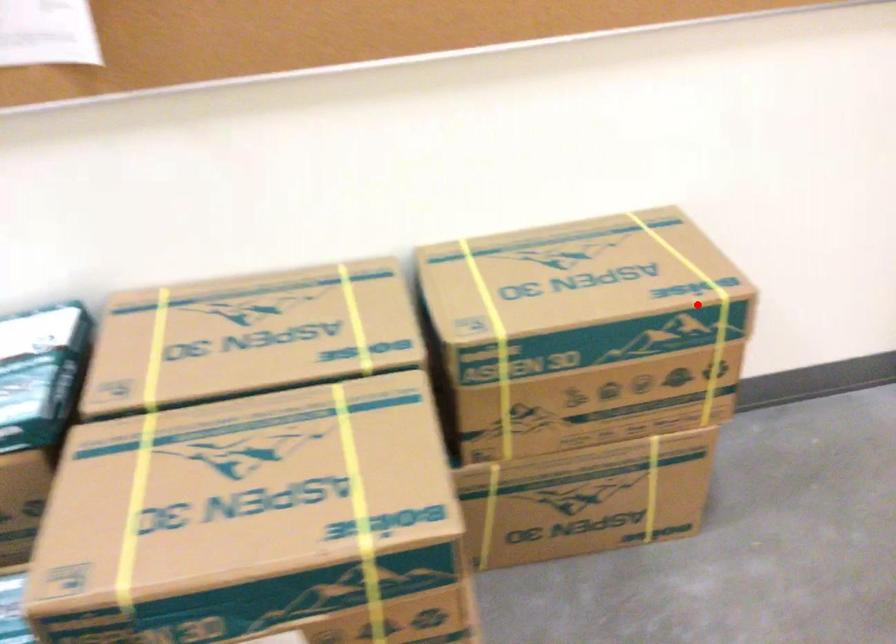
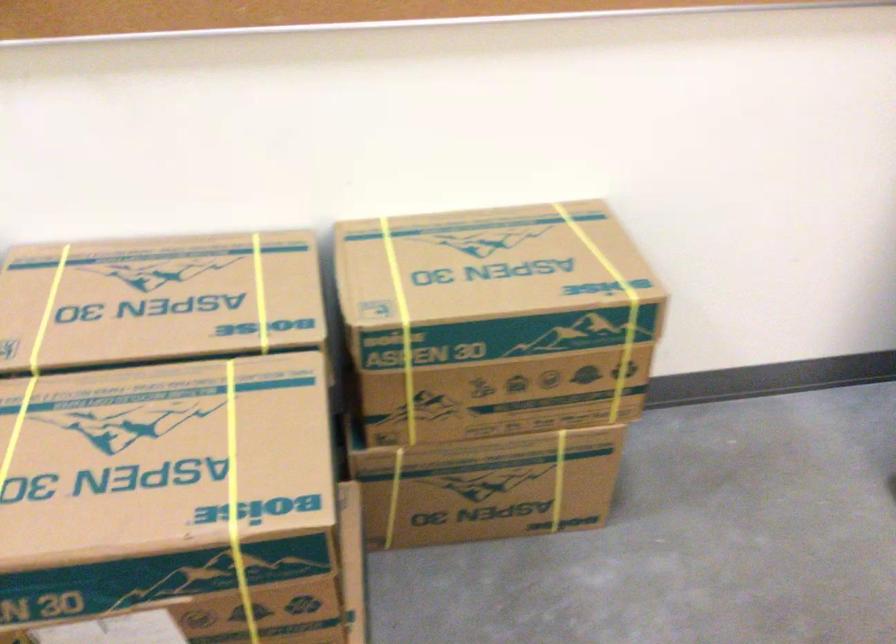
Find the pixel in the second image that matches the highlighted location in the first image.

(609, 304)